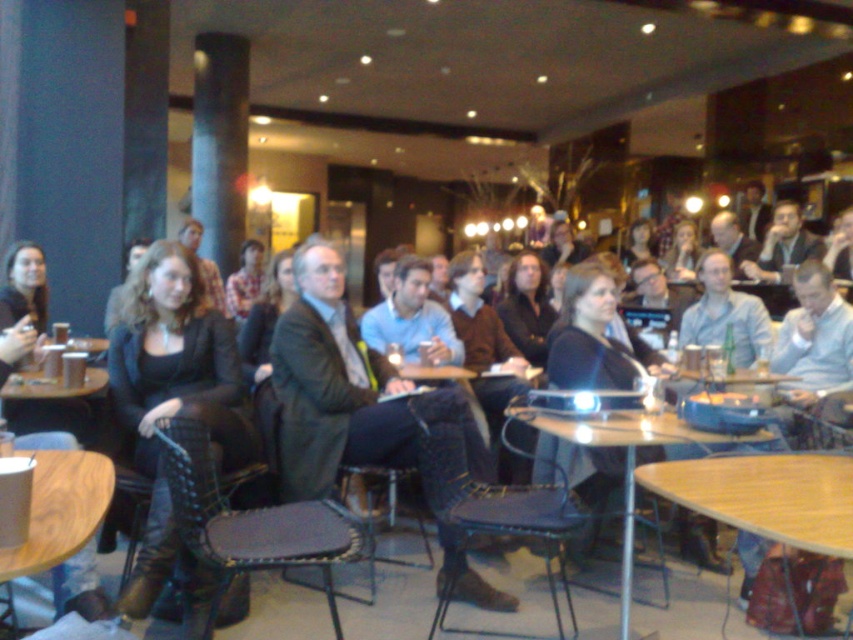
You are standing in the room and want to move from the point at coordinate (238, 604) to the point at coordinate (816, 531). Which direction should you move in relation to the camera view?

You should move downward and to the left in the camera view because point (816, 531) is located lower and to the left compared to point (238, 604).

Based on the photo, you are standing at the entrance of the room and want to approach the person wearing the leather boots at center. According to the coordinates provided, in which direction should you move first?

The leather boots at center are located at coordinates point (172, 392). Since the x and y coordinates are both greater than 0.5, you should move towards the upper right direction to reach the person wearing the leather boots at center.